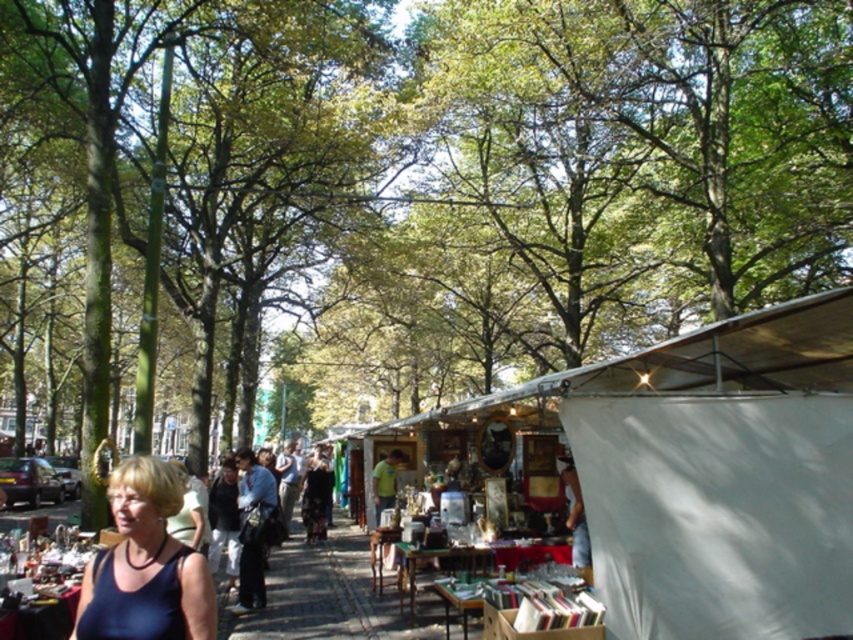
Can you confirm if white fabric canopy at center is taller than matte blue tank top at lower left?

Yes.

Is point (389, 428) closer to viewer compared to point (170, 632)?

That is False.

This screenshot has height=640, width=853. In order to click on white fabric canopy at center in this screenshot , I will do `click(701, 472)`.